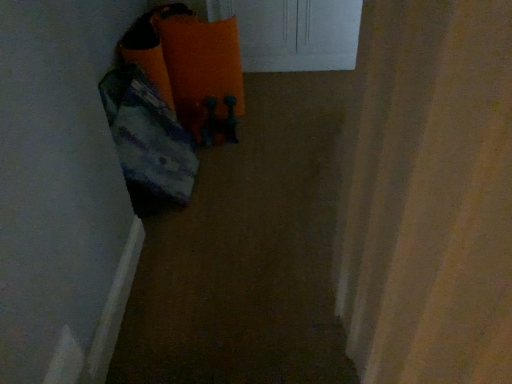
Where is `beige textured curtain at right`? The image size is (512, 384). beige textured curtain at right is located at coordinates (429, 196).

The width and height of the screenshot is (512, 384). Describe the element at coordinates (429, 196) in the screenshot. I see `beige textured curtain at right` at that location.

I want to click on beige textured curtain at right, so click(429, 196).